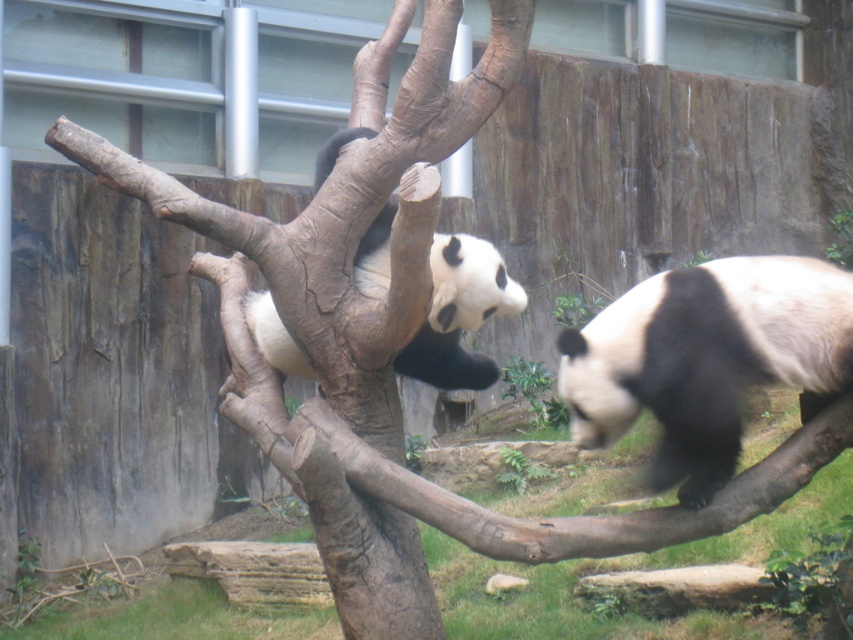
You are a zookeeper trying to locate two specific points in the enclosure. The first point is at coordinate point(587,432) and the second is at point(265,310). From your vantage point, which point is closer to you?

Point(587,432) is in front of point(265,310), so it is closer to you.

You are a zookeeper who needs to place a feeding tray between the black fuzzy panda at right and the black and white fur at upper center. The tray requires a minimum of 1 meter of space to be placed safely. Based on the scene, can you safely place the feeding tray between them?

The black fuzzy panda at right and the black and white fur at upper center are 97.80 centimeters apart from each other. Since 97.80 cm is less than 1 meter, the feeding tray cannot be placed safely between them due to insufficient space.